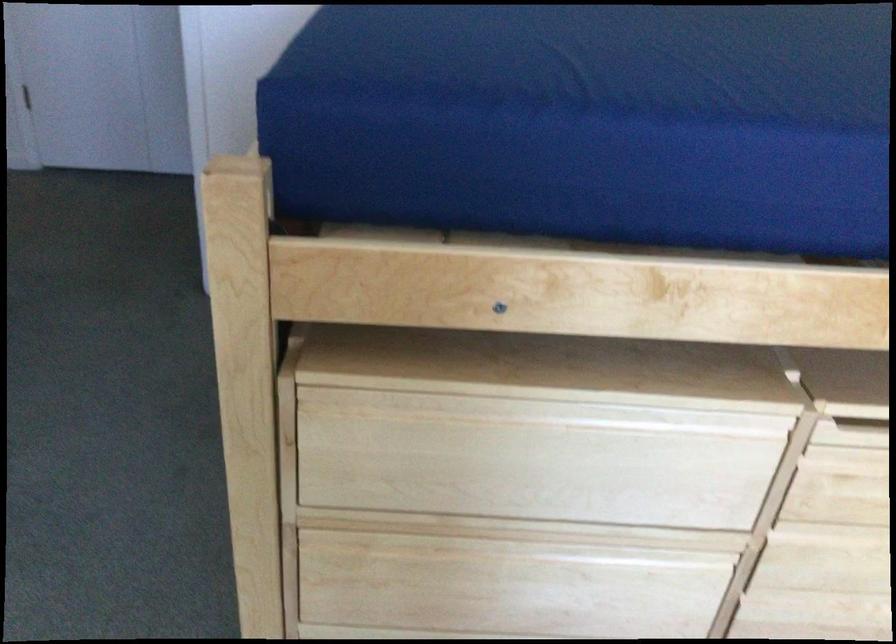
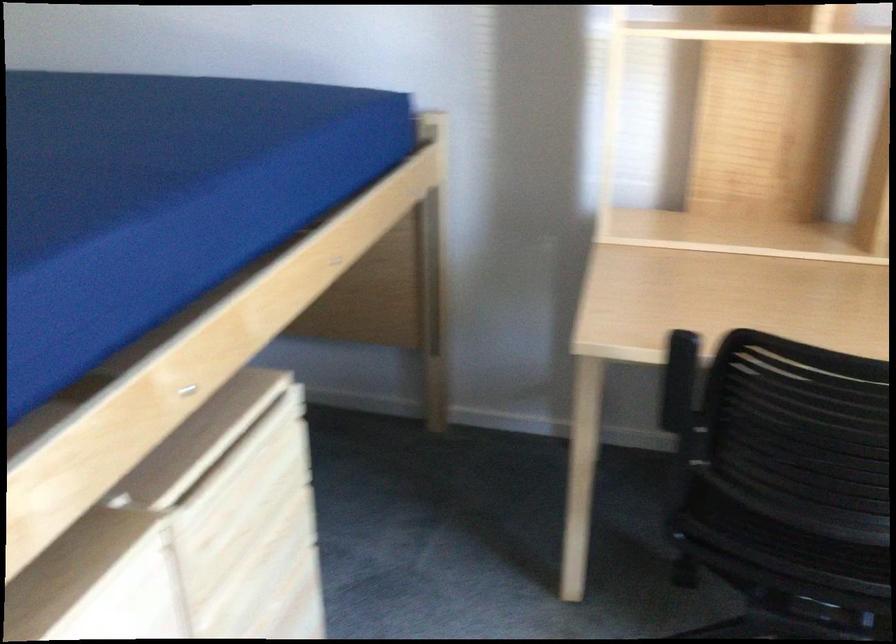
How did the camera likely rotate?

The camera rotated toward right-down.